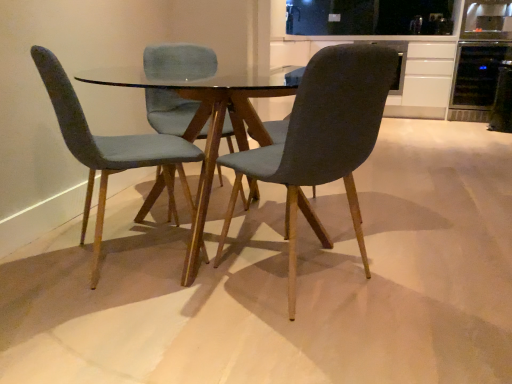
At what (x,y) coordinates should I click in order to perform the action: click on free spot in front of dark gray fabric chair at center, which is counted as the second chair, starting from the left. Please return your answer as a coordinate pair (x, y). Looking at the image, I should click on (305, 346).